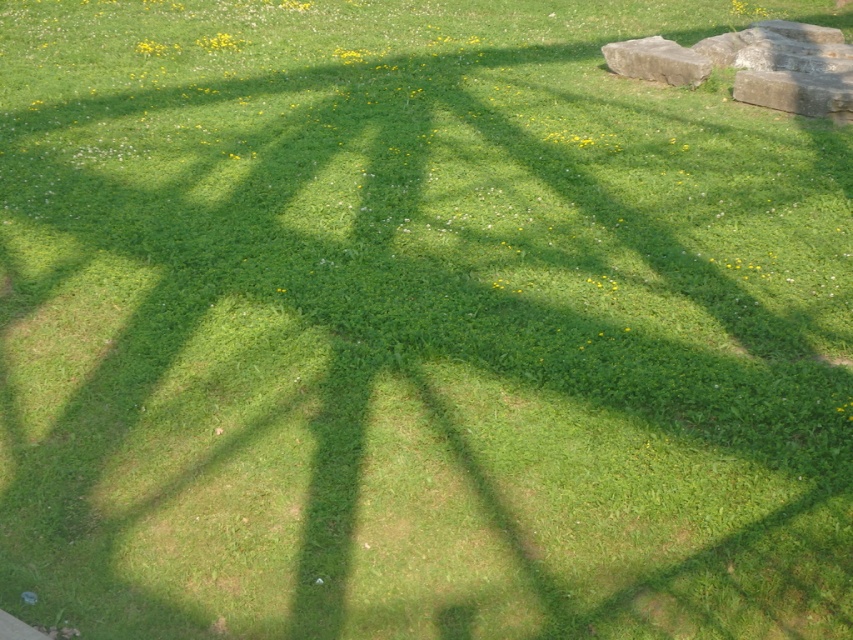
Question: Which of the following is the farthest from the observer?

Choices:
 (A) gray stone at upper right
 (B) gray rough stone at upper right

Answer: (B)

Question: Does gray stone at upper right appear on the left side of gray rough stone at upper right?

Choices:
 (A) yes
 (B) no

Answer: (B)

Question: Does gray stone at upper right lie behind gray rough stone at upper right?

Choices:
 (A) no
 (B) yes

Answer: (A)

Question: Does gray stone at upper right appear over gray rough stone at upper right?

Choices:
 (A) no
 (B) yes

Answer: (A)

Question: Which point appears farthest from the camera in this image?

Choices:
 (A) (682, 74)
 (B) (773, 99)

Answer: (A)